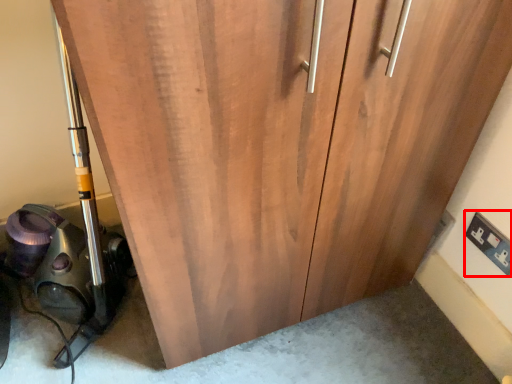
Question: In this image, where is electric outlet (annotated by the red box) located relative to equipment?

Choices:
 (A) left
 (B) right

Answer: (B)